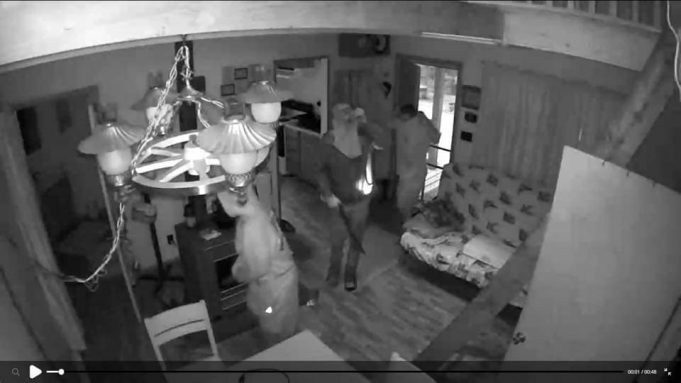
Where is `doorknob`? Image resolution: width=681 pixels, height=383 pixels. doorknob is located at coordinates (513, 337).